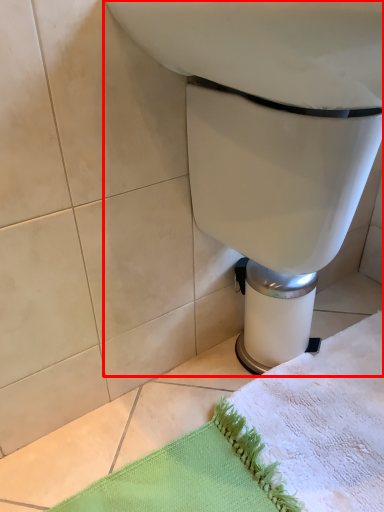
Question: Observing the image, what is the correct spatial positioning of toilet (annotated by the red box) in reference to bath towel?

Choices:
 (A) right
 (B) left

Answer: (B)